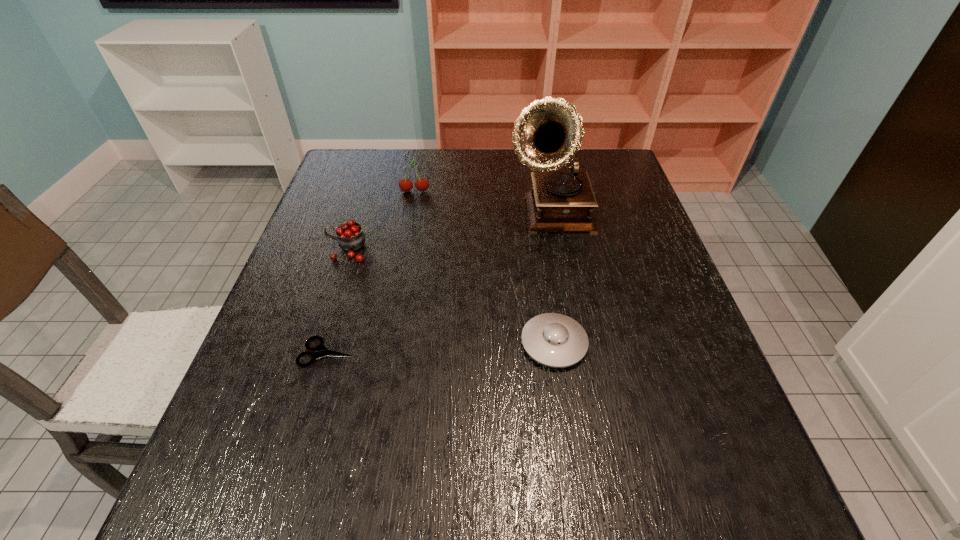
This screenshot has width=960, height=540. Find the location of `object located at the far edge`. object located at the far edge is located at coordinates (421, 184).

Locate an element on the screen. The height and width of the screenshot is (540, 960). cherry that is at the left edge is located at coordinates (350, 237).

Image resolution: width=960 pixels, height=540 pixels. Find the location of `shears located at the left edge`. shears located at the left edge is located at coordinates (321, 351).

This screenshot has height=540, width=960. I want to click on object present at the right edge, so click(x=548, y=133).

What are the coordinates of `vacant space at the far edge of the desktop` in the screenshot? It's located at (487, 153).

This screenshot has width=960, height=540. I want to click on vacant space at the near edge of the desktop, so coord(418,490).

At what (x,y) coordinates should I click in order to perform the action: click on vacant region at the left edge of the desktop. Please return your answer as a coordinate pair (x, y). The width and height of the screenshot is (960, 540). Looking at the image, I should click on (320, 403).

Locate an element on the screen. The height and width of the screenshot is (540, 960). vacant area at the right edge is located at coordinates (643, 238).

The image size is (960, 540). Identify the location of free region at the far right corner. click(x=589, y=153).

Where is `vacant space at the near right corner of the desktop`? This screenshot has width=960, height=540. vacant space at the near right corner of the desktop is located at coordinates (670, 479).